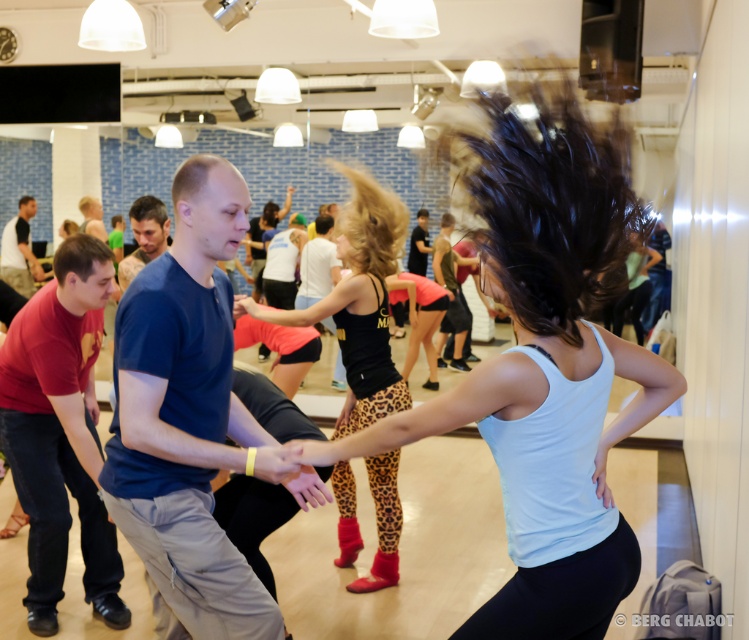
Question: From the image, what is the correct spatial relationship of white matte tank top at center in relation to leopard print leggings at center?

Choices:
 (A) left
 (B) right

Answer: (B)

Question: Which of the following is the farthest from the observer?

Choices:
 (A) leopard print leggings at center
 (B) white matte tank top at center

Answer: (A)

Question: Does white matte tank top at center appear over leopard print leggings at center?

Choices:
 (A) no
 (B) yes

Answer: (B)

Question: Is white matte tank top at center to the left of leopard print leggings at center from the viewer's perspective?

Choices:
 (A) no
 (B) yes

Answer: (A)